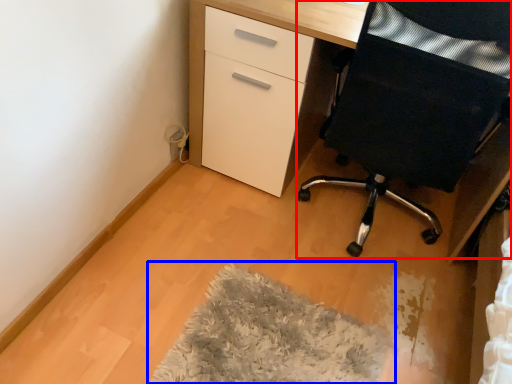
Question: Which object is closer to the camera taking this photo, furniture (highlighted by a red box) or mat (highlighted by a blue box)?

Choices:
 (A) furniture
 (B) mat

Answer: (A)